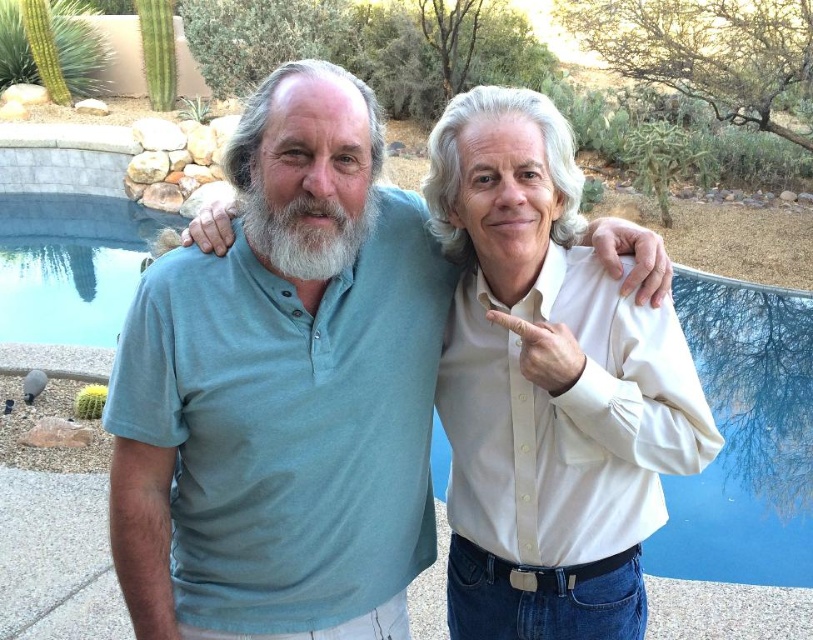
Can you confirm if matte green shirt at center is thinner than white glossy shirt at right?

No.

Consider the image. Can you confirm if matte green shirt at center is wider than white glossy shirt at right?

Yes, matte green shirt at center is wider than white glossy shirt at right.

This screenshot has height=640, width=813. Describe the element at coordinates (281, 401) in the screenshot. I see `matte green shirt at center` at that location.

The image size is (813, 640). Identify the location of matte green shirt at center. coord(281,401).

Which is more to the left, matte green shirt at center or white matte beard at center?

Positioned to the left is matte green shirt at center.

Who is more forward, (428, 397) or (262, 225)?

Positioned in front is point (262, 225).

You are a GUI agent. You are given a task and a screenshot of the screen. Output one action in this format:
    pyautogui.click(x=<x>, y=<y>)
    Task: Click on the matte green shirt at center
    The width and height of the screenshot is (813, 640).
    Given the screenshot: What is the action you would take?
    pyautogui.click(x=281, y=401)

Based on the photo, does white glossy shirt at right have a lesser width compared to white matte beard at center?

Incorrect, white glossy shirt at right's width is not less than white matte beard at center's.

Is point (651, 460) behind point (368, 228)?

Yes, it is.

The image size is (813, 640). I want to click on white glossy shirt at right, so click(546, 388).